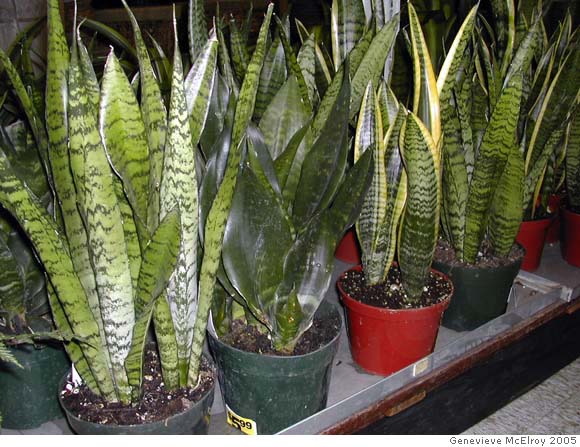
This screenshot has width=580, height=447. In order to click on wooden trim in this screenshot , I will do `click(451, 372)`.